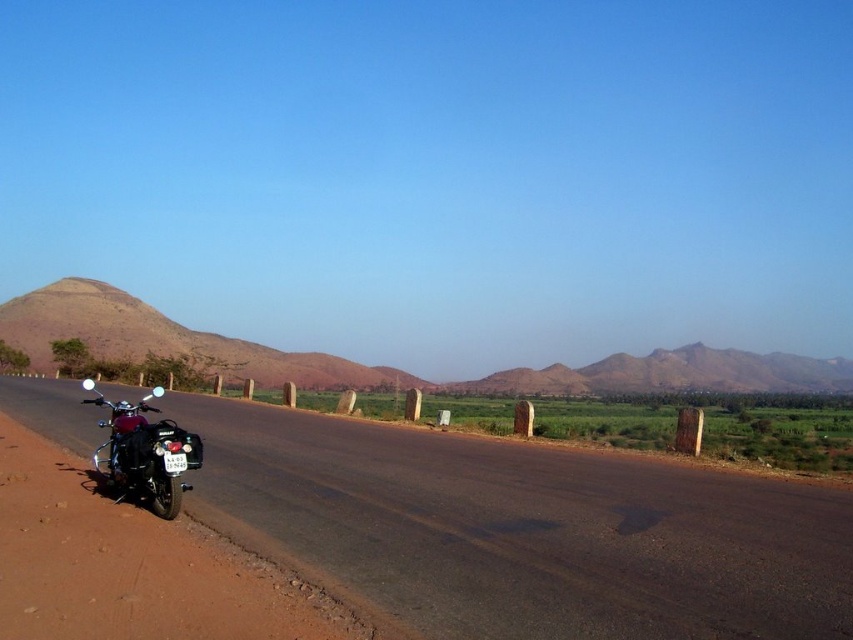
Does brown dirt track at lower left appear over shiny chrome motorcycle at left?

Incorrect, brown dirt track at lower left is not positioned above shiny chrome motorcycle at left.

Is brown dirt track at lower left thinner than shiny chrome motorcycle at left?

Incorrect, brown dirt track at lower left's width is not less than shiny chrome motorcycle at left's.

You are a GUI agent. You are given a task and a screenshot of the screen. Output one action in this format:
    pyautogui.click(x=<x>, y=<y>)
    Task: Click on the brown dirt track at lower left
    
    Given the screenshot: What is the action you would take?
    pyautogui.click(x=526, y=531)

Can you confirm if brown dirt track at lower left is wider than brown matte mountain at left?

No, brown dirt track at lower left is not wider than brown matte mountain at left.

Is point (646, 548) closer to camera compared to point (100, 326)?

Yes, point (646, 548) is closer to viewer.

Where is `brown dirt track at lower left`? brown dirt track at lower left is located at coordinates [526, 531].

Looking at this image, can you confirm if brown matte mountain at left is shorter than shiny chrome motorcycle at left?

In fact, brown matte mountain at left may be taller than shiny chrome motorcycle at left.

At what (x,y) coordinates should I click in order to perform the action: click on brown matte mountain at left. Please return your answer as a coordinate pair (x, y). This screenshot has width=853, height=640. Looking at the image, I should click on (167, 339).

Where is `brown matte mountain at left`? This screenshot has height=640, width=853. brown matte mountain at left is located at coordinates (167, 339).